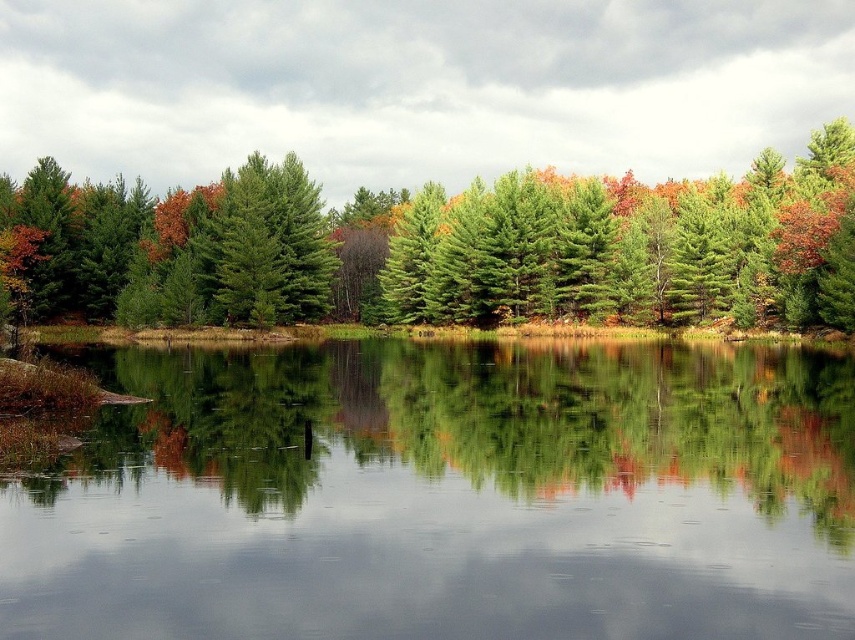
Question: Which of the following is the closest to the observer?

Choices:
 (A) (358, 298)
 (B) (40, 566)

Answer: (B)

Question: Does smooth reflective water at center have a larger size compared to green pine trees at center?

Choices:
 (A) no
 (B) yes

Answer: (A)

Question: Does smooth reflective water at center lie behind green pine trees at center?

Choices:
 (A) yes
 (B) no

Answer: (B)

Question: Does smooth reflective water at center appear on the right side of green pine trees at center?

Choices:
 (A) yes
 (B) no

Answer: (A)